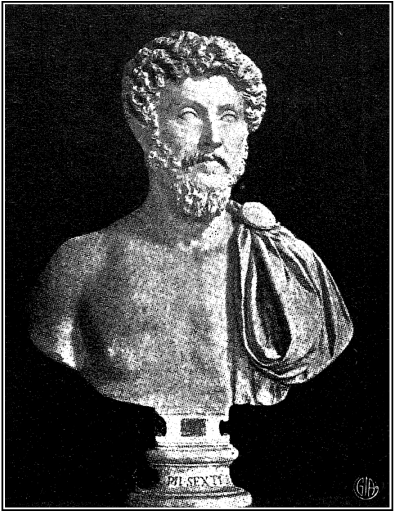
Image resolution: width=394 pixels, height=512 pixels. In order to click on statue in this screenshot , I will do `click(190, 233)`.